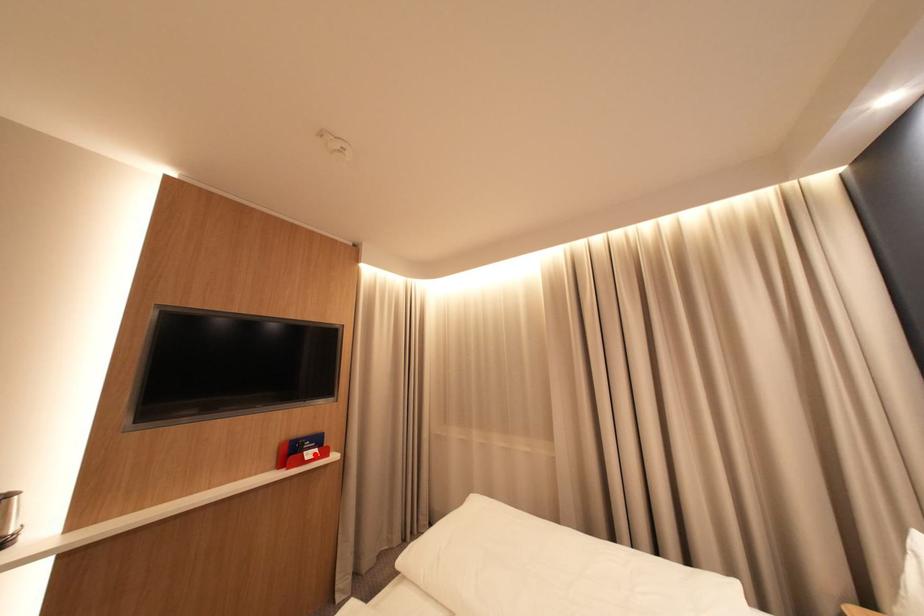
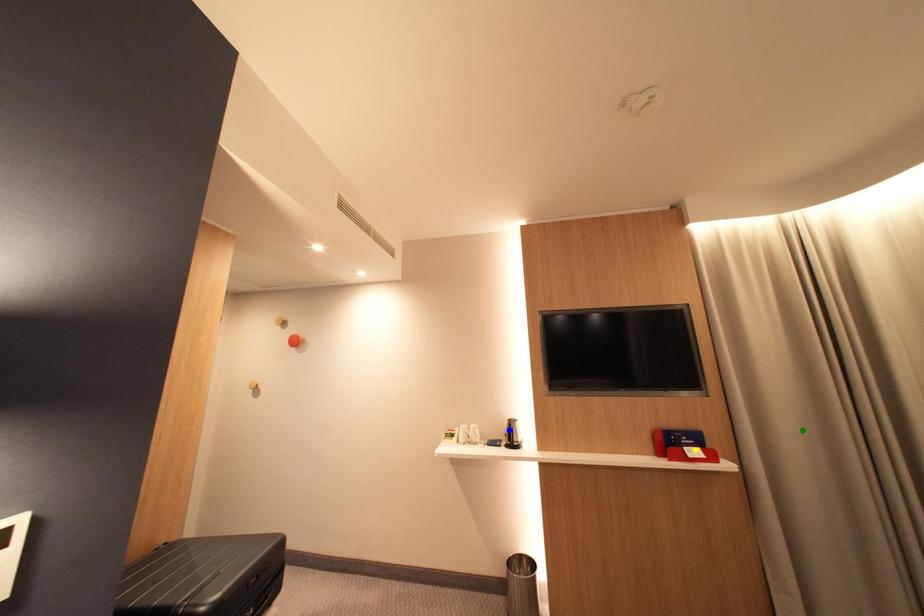
Question: I am providing you with two images of the same scene from different viewpoints. A red point is marked on the first image. You are given multiple points on the second image. Can you choose the point in image 2 that corresponds to the point in image 1?

Choices:
 (A) green point
 (B) blue point
 (C) yellow point

Answer: (C)